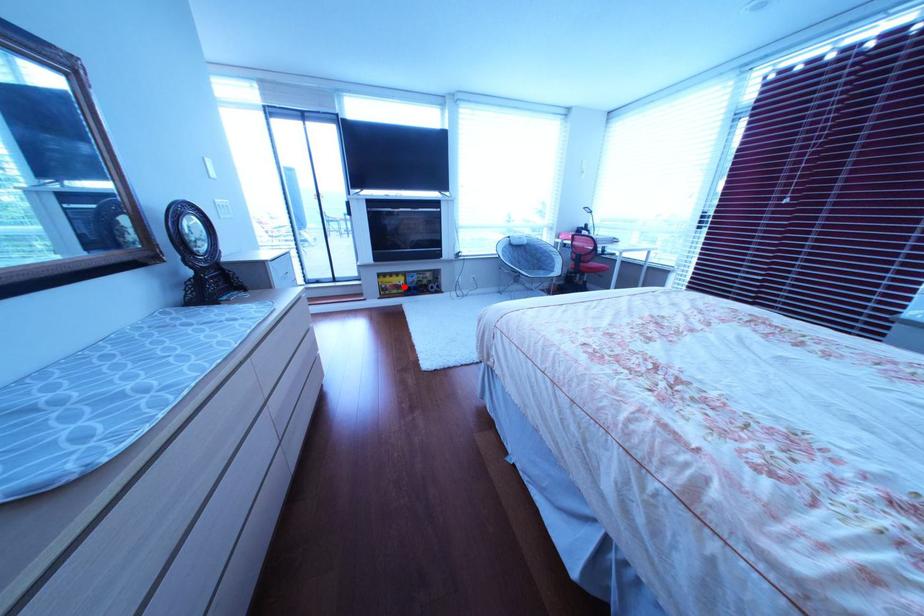
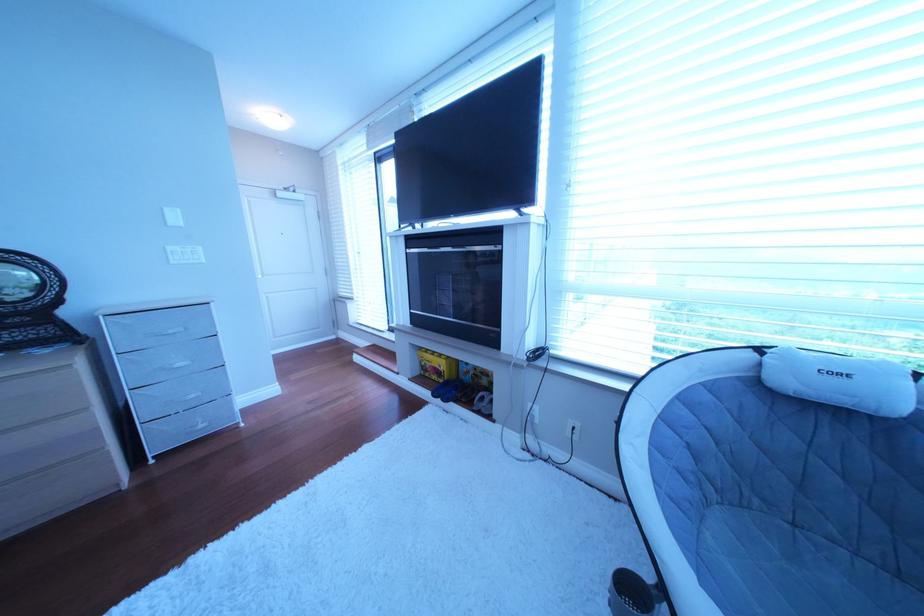
Question: I am providing you with two images of the same scene from different viewpoints. A red point is shown in image1. For the corresponding object point in image2, is it positioned nearer or farther from the camera?

Choices:
 (A) Nearer
 (B) Farther

Answer: (B)